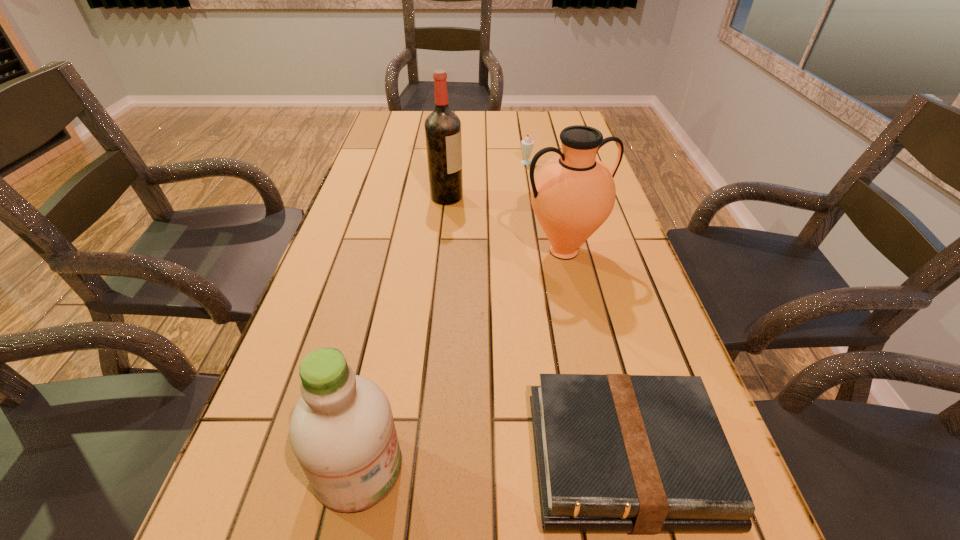
The width and height of the screenshot is (960, 540). Identify the location of free space in the image that satisfies the following two spatial constraints: 1. on the straw side of the milkshake; 2. on the front-facing side of the fourth nearest object. [535, 197].

The height and width of the screenshot is (540, 960). Identify the location of vacant area that satisfies the following two spatial constraints: 1. on the front-facing side of the liquor; 2. on the right side of the third nearest object. (442, 251).

Identify the location of blank space that satisfies the following two spatial constraints: 1. on the spine side of the hardback book; 2. on the front label of the cleansing agent. The height and width of the screenshot is (540, 960). (627, 468).

Find the location of a particular element. This screenshot has height=540, width=960. vacant region that satisfies the following two spatial constraints: 1. on the straw side of the milkshake; 2. on the front label of the cleansing agent is located at coordinates (581, 468).

In order to click on free space that satisfies the following two spatial constraints: 1. on the spine side of the shortest object; 2. on the front label of the third tallest object in this screenshot , I will do `click(627, 468)`.